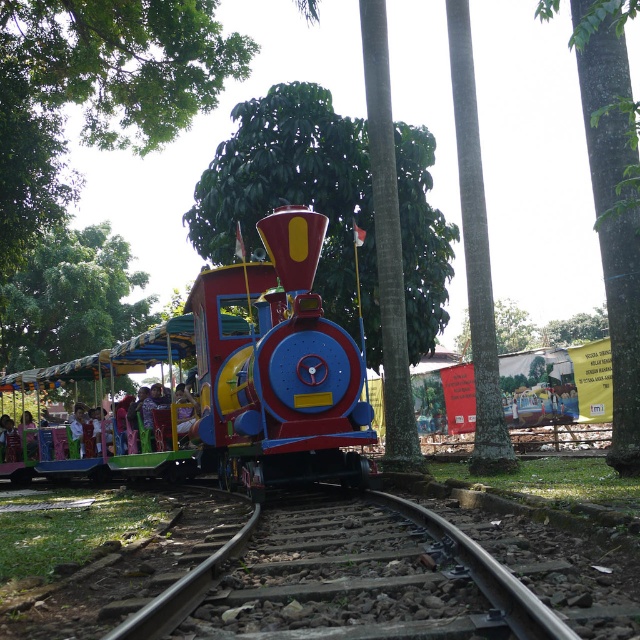
Question: Does brown gravel train track at center have a larger size compared to green rough bark tree at center?

Choices:
 (A) no
 (B) yes

Answer: (A)

Question: Considering the relative positions of shiny metallic train at center and green leafy tree at center in the image provided, where is shiny metallic train at center located with respect to green leafy tree at center?

Choices:
 (A) above
 (B) below

Answer: (B)

Question: Which point is farther to the camera?

Choices:
 (A) green leafy tree at upper left
 (B) shiny metallic train at center

Answer: (A)

Question: Considering the real-world distances, which object is closest to the green rough bark tree at center?

Choices:
 (A) green leafy tree at upper left
 (B) brown gravel train track at center
 (C) shiny metallic train at center

Answer: (B)

Question: Among these points, which one is nearest to the camera?

Choices:
 (A) (216, 627)
 (B) (129, 44)

Answer: (A)

Question: Can you confirm if green leafy tree at upper center is smaller than green rough bark tree at center?

Choices:
 (A) no
 (B) yes

Answer: (A)